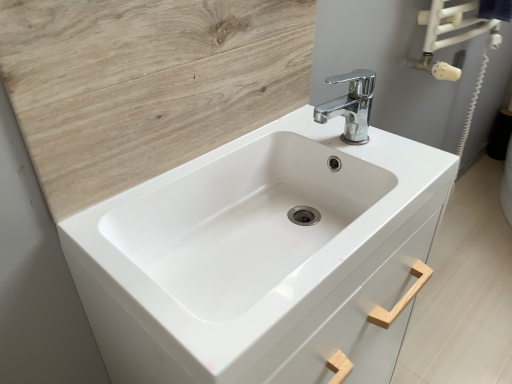
Question: From the image's perspective, is white glossy sink at center below white wood drawer at center?

Choices:
 (A) no
 (B) yes

Answer: (B)

Question: Are white glossy sink at center and white wood drawer at center located far from each other?

Choices:
 (A) yes
 (B) no

Answer: (B)

Question: Is the surface of white glossy sink at center in direct contact with white wood drawer at center?

Choices:
 (A) yes
 (B) no

Answer: (B)

Question: Does white glossy sink at center have a larger size compared to white wood drawer at center?

Choices:
 (A) no
 (B) yes

Answer: (B)

Question: Is white glossy sink at center oriented towards white wood drawer at center?

Choices:
 (A) no
 (B) yes

Answer: (A)

Question: Considering the relative sizes of white glossy sink at center and white wood drawer at center in the image provided, is white glossy sink at center thinner than white wood drawer at center?

Choices:
 (A) no
 (B) yes

Answer: (B)

Question: Does chrome metallic faucet at upper center have a lesser height compared to white glossy sink at center?

Choices:
 (A) yes
 (B) no

Answer: (A)

Question: Considering the relative positions of chrome metallic faucet at upper center and white glossy sink at center in the image provided, is chrome metallic faucet at upper center in front of white glossy sink at center?

Choices:
 (A) yes
 (B) no

Answer: (B)

Question: From a real-world perspective, is chrome metallic faucet at upper center beneath white glossy sink at center?

Choices:
 (A) no
 (B) yes

Answer: (A)

Question: Is white glossy sink at center surrounded by chrome metallic faucet at upper center?

Choices:
 (A) no
 (B) yes

Answer: (A)

Question: Does chrome metallic faucet at upper center have a greater height compared to white glossy sink at center?

Choices:
 (A) yes
 (B) no

Answer: (B)

Question: From the image's perspective, is chrome metallic faucet at upper center above white glossy sink at center?

Choices:
 (A) yes
 (B) no

Answer: (A)

Question: Considering the relative positions of white glossy sink at center and wooden at upper left in the image provided, is white glossy sink at center behind wooden at upper left?

Choices:
 (A) no
 (B) yes

Answer: (A)